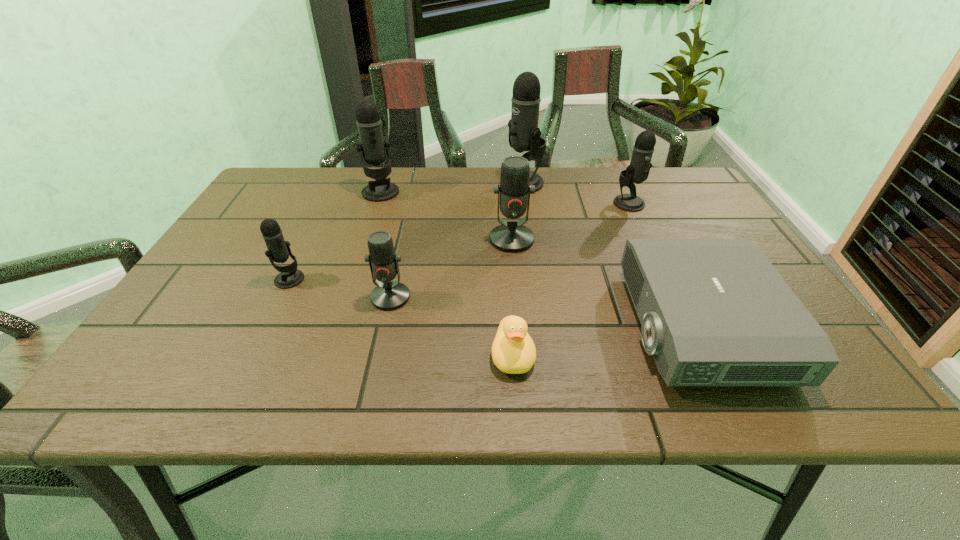
Locate an element on the screen. Image resolution: width=960 pixels, height=540 pixels. vacant space at the far left corner is located at coordinates (314, 185).

You are a GUI agent. You are given a task and a screenshot of the screen. Output one action in this format:
    pyautogui.click(x=<x>, y=<y>)
    Task: Click on the vacant area between the rightmost microphone and the leftmost microphone
    The width and height of the screenshot is (960, 540).
    Given the screenshot: What is the action you would take?
    pyautogui.click(x=459, y=241)

Identify the location of unoccupied position between the second tallest microphone and the bigger red microphone. (446, 216).

I want to click on empty location between the projector and the seventh object from right to left, so click(540, 259).

Find the location of `empty space between the second black microphone from right to left and the third biggest black microphone`. empty space between the second black microphone from right to left and the third biggest black microphone is located at coordinates point(576,193).

The width and height of the screenshot is (960, 540). What are the coordinates of `free space between the projector and the third object from left to right` in the screenshot? It's located at (544, 311).

The width and height of the screenshot is (960, 540). I want to click on free space between the farther red microphone and the rightmost black microphone, so click(570, 221).

This screenshot has height=540, width=960. I want to click on empty space between the second tallest object and the second black microphone from right to left, so click(451, 188).

This screenshot has width=960, height=540. I want to click on vacant area that lies between the smaller red microphone and the biggest black microphone, so click(456, 240).

Locate which object is the sixth closest to the rightmost microphone. Please provide its 2D coordinates. Your answer should be formatted as a tuple, i.e. [(x, y)], where the tuple contains the x and y coordinates of a point satisfying the conditions above.

[(373, 146)]